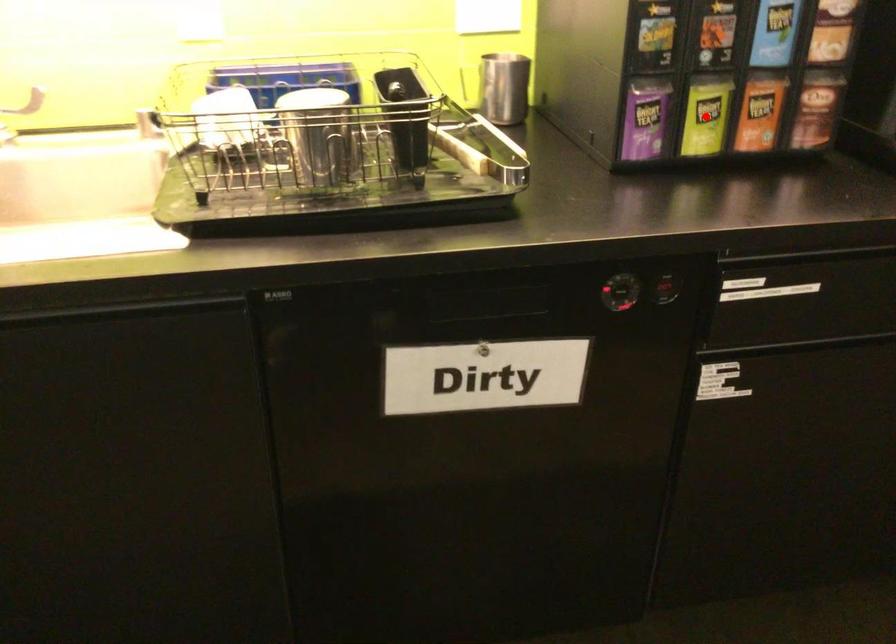
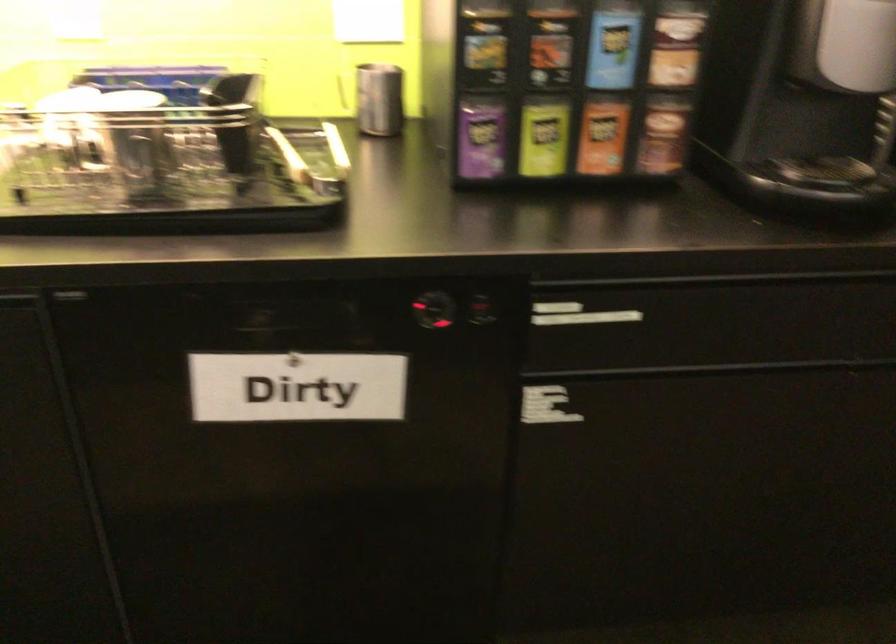
Locate, in the second image, the point that corresponds to the highlighted location in the first image.

(543, 138)